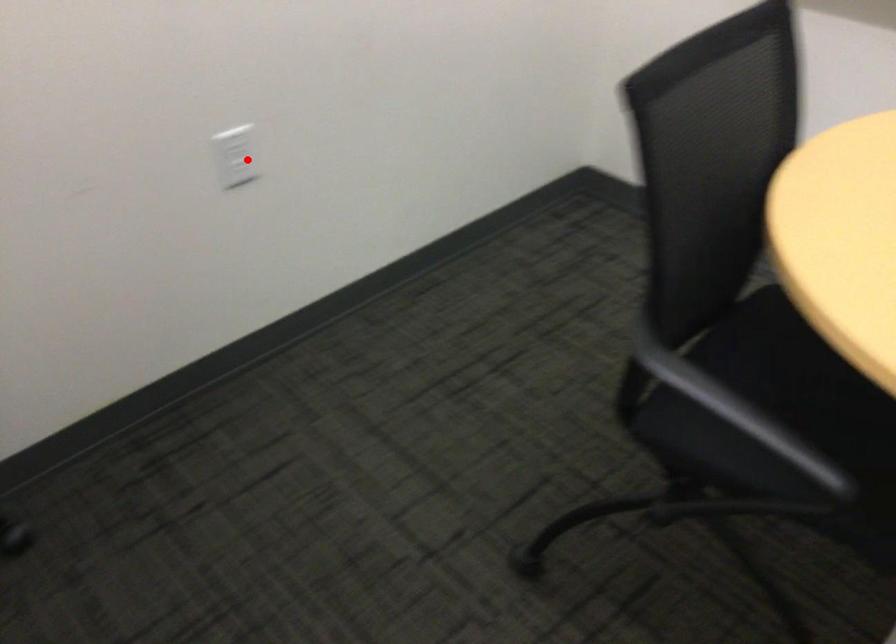
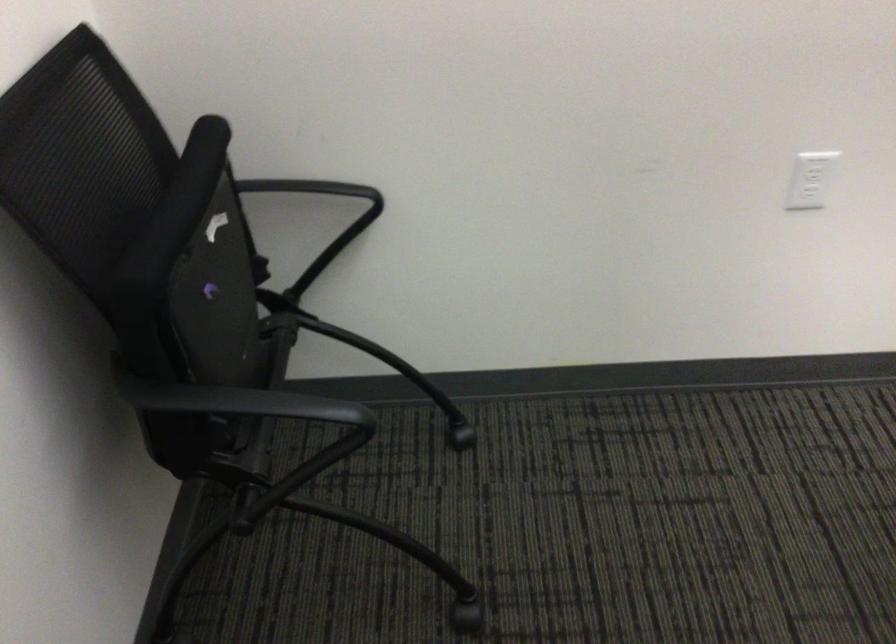
Question: I am providing you with two images of the same scene from different viewpoints. Given a red point in image1, look at the same physical point in image2. Is it:

Choices:
 (A) Closer to the viewpoint
 (B) Farther from the viewpoint

Answer: (A)